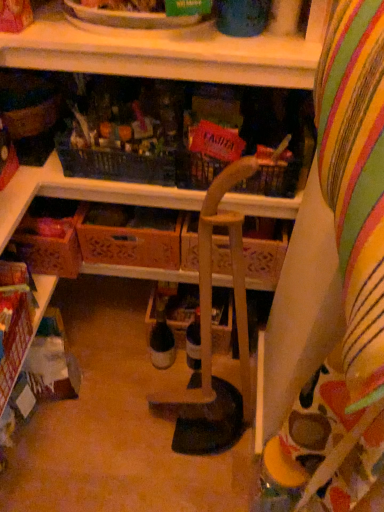
The height and width of the screenshot is (512, 384). Describe the element at coordinates (161, 338) in the screenshot. I see `translucent glass bottle at center` at that location.

What do you see at coordinates (24, 335) in the screenshot? Image resolution: width=384 pixels, height=512 pixels. I see `wooden crate at lower left, marked as the second shelf in a top-to-bottom arrangement` at bounding box center [24, 335].

Image resolution: width=384 pixels, height=512 pixels. What do you see at coordinates (211, 337) in the screenshot?
I see `wooden chair at center` at bounding box center [211, 337].

What is the approximate width of wooden crate at center, marked as the 2th drawer in a left-to-right arrangement?

wooden crate at center, marked as the 2th drawer in a left-to-right arrangement, is 11.72 inches in width.

What do you see at coordinates (130, 236) in the screenshot?
I see `wooden crate at center, positioned as the first drawer in right-to-left order` at bounding box center [130, 236].

Measure the distance between point (273,71) and camera.

Point (273,71) and camera are 87.20 centimeters apart from each other.

Locate an element on the screen. This screenshot has height=512, width=384. translucent glass bottle at center is located at coordinates (161, 338).

In the scene shown: Which object is positioned more to the left, wooden crate at lower left, the 1th shelf ordered from the bottom, or wooden crate at center, positioned as the first drawer in right-to-left order?

From the viewer's perspective, wooden crate at lower left, the 1th shelf ordered from the bottom, appears more on the left side.

From the image's perspective, is wooden crate at lower left, which ranks as the first shelf in left-to-right order, positioned above or below wooden crate at center, positioned as the first drawer in right-to-left order?

Based on their image positions, wooden crate at lower left, which ranks as the first shelf in left-to-right order, is located beneath wooden crate at center, positioned as the first drawer in right-to-left order.

Which of these two, wooden crate at lower left, which is counted as the second shelf, starting from the right, or wooden crate at center, marked as the 2th drawer in a left-to-right arrangement, is bigger?

With larger size is wooden crate at center, marked as the 2th drawer in a left-to-right arrangement.

Is wooden crate at lower left, which is counted as the second shelf, starting from the right, looking in the opposite direction of wooden crate at center, marked as the 2th drawer in a left-to-right arrangement?

wooden crate at lower left, which is counted as the second shelf, starting from the right, is not turned away from wooden crate at center, marked as the 2th drawer in a left-to-right arrangement.

What's the angular difference between wooden crate at center, marked as the 2th drawer in a left-to-right arrangement, and wooden at upper center, placed as the 1th shelf when sorted from top to bottom,'s facing directions?

1.4 degrees separate the facing orientations of wooden crate at center, marked as the 2th drawer in a left-to-right arrangement, and wooden at upper center, placed as the 1th shelf when sorted from top to bottom.

Considering the relative sizes of wooden crate at center, marked as the 2th drawer in a left-to-right arrangement, and wooden at upper center, the 2th shelf when ordered from bottom to top, in the image provided, is wooden crate at center, marked as the 2th drawer in a left-to-right arrangement, smaller than wooden at upper center, the 2th shelf when ordered from bottom to top,?

Indeed, wooden crate at center, marked as the 2th drawer in a left-to-right arrangement, has a smaller size compared to wooden at upper center, the 2th shelf when ordered from bottom to top.

Is wooden crate at center, positioned as the first drawer in right-to-left order, not within wooden at upper center, which is counted as the second shelf, starting from the left?

Absolutely, wooden crate at center, positioned as the first drawer in right-to-left order, is external to wooden at upper center, which is counted as the second shelf, starting from the left.

Does wooden crate at center, marked as the 2th drawer in a left-to-right arrangement, have a lesser width compared to wooden at upper center, placed as the 1th shelf when sorted from top to bottom?

Yes.

Which is in front, wooden chair at center or wooden at upper center, the first shelf viewed from the right?

Positioned in front is wooden chair at center.

I want to click on armchair below the wooden at upper center, placed as the 1th shelf when sorted from top to bottom (from the image's perspective), so click(x=211, y=337).

Would you say wooden at upper center, which is counted as the second shelf, starting from the left, is part of wooden chair at center's contents?

No.

From the image's perspective, is wooden chair at center located above or below wooden at upper center, the first shelf viewed from the right?

wooden chair at center is below wooden at upper center, the first shelf viewed from the right.

Is wooden chair at center not near wooden crate at center, positioned as the first drawer in right-to-left order?

Actually, wooden chair at center and wooden crate at center, positioned as the first drawer in right-to-left order, are a little close together.

Who is taller, wooden chair at center or wooden crate at center, marked as the 2th drawer in a left-to-right arrangement?

With more height is wooden chair at center.

Considering the relative positions of wooden chair at center and wooden crate at center, positioned as the first drawer in right-to-left order, in the image provided, is wooden chair at center to the left of wooden crate at center, positioned as the first drawer in right-to-left order, from the viewer's perspective?

No, wooden chair at center is not to the left of wooden crate at center, positioned as the first drawer in right-to-left order.

From a real-world perspective, is wooden chair at center above or below wooden crate at center, marked as the 2th drawer in a left-to-right arrangement?

wooden chair at center is situated higher than wooden crate at center, marked as the 2th drawer in a left-to-right arrangement, in the real world.

From a real-world perspective, who is located higher, wooden chair at center or translucent glass bottle at center?

wooden chair at center, from a real-world perspective.

Is point (248, 408) more distant than point (164, 329)?

No, it is not.

Is wooden chair at center oriented away from translucent glass bottle at center?

No, wooden chair at center's orientation is not away from translucent glass bottle at center.

Image resolution: width=384 pixels, height=512 pixels. Find the location of `armchair on the right side of translucent glass bottle at center`. armchair on the right side of translucent glass bottle at center is located at coordinates (211, 337).

Is wooden crate at center, marked as the 2th drawer in a left-to-right arrangement, bigger or smaller than wooden chair at center?

Considering their sizes, wooden crate at center, marked as the 2th drawer in a left-to-right arrangement, takes up less space than wooden chair at center.

Which is in front, wooden crate at center, positioned as the first drawer in right-to-left order, or wooden chair at center?

wooden chair at center.

Does wooden crate at center, marked as the 2th drawer in a left-to-right arrangement, have a greater width compared to wooden chair at center?

Yes, wooden crate at center, marked as the 2th drawer in a left-to-right arrangement, is wider than wooden chair at center.

Are wooden crate at center, positioned as the first drawer in right-to-left order, and wooden chair at center making contact?

No, wooden crate at center, positioned as the first drawer in right-to-left order, is not next to wooden chair at center.

From the wooden at upper center, the 2th shelf when ordered from bottom to top, count the 2nd drawer to the left and point to it. Please provide its 2D coordinates.

[(49, 238)]

Could you tell me if wooden at upper center, the 2th shelf when ordered from bottom to top, is facing wooden crate at lower left, acting as the first drawer starting from the left?

No, wooden at upper center, the 2th shelf when ordered from bottom to top, is not turned towards wooden crate at lower left, acting as the first drawer starting from the left.

Which is in front, wooden at upper center, the 2th shelf when ordered from bottom to top, or wooden crate at lower left, the 2th drawer when ordered from right to left?

wooden at upper center, the 2th shelf when ordered from bottom to top, is more forward.

Is wooden at upper center, the 2th shelf when ordered from bottom to top, at the right side of wooden crate at lower left, acting as the first drawer starting from the left?

Yes, wooden at upper center, the 2th shelf when ordered from bottom to top, is to the right of wooden crate at lower left, acting as the first drawer starting from the left.

Identify the location of the 1st shelf in front when counting from the wooden crate at center, positioned as the first drawer in right-to-left order. (24, 335).

Locate an element on the screen. the 2nd drawer behind the wooden at upper center, placed as the 1th shelf when sorted from top to bottom, counting from the anchor's position is located at coordinates (130, 236).

From the image, which object appears to be nearer to wooden chair at center, wooden crate at lower left, the 2th drawer when ordered from right to left, or translucent glass bottle at center?

translucent glass bottle at center is positioned closer to the anchor wooden chair at center.

When comparing their distances from wooden crate at lower left, the 2th drawer when ordered from right to left, does wooden chair at center or wooden crate at lower left, the 1th shelf ordered from the bottom, seem closer?

Among the two, wooden crate at lower left, the 1th shelf ordered from the bottom, is located nearer to wooden crate at lower left, the 2th drawer when ordered from right to left.

Which object lies further to the anchor point wooden crate at lower left, the 2th drawer when ordered from right to left, wooden at upper center, which is counted as the second shelf, starting from the left, or translucent glass bottle at center?

Among the two, wooden at upper center, which is counted as the second shelf, starting from the left, is located further to wooden crate at lower left, the 2th drawer when ordered from right to left.

Estimate the real-world distances between objects in this image. Which object is closer to wooden chair at center, translucent glass bottle at center or wooden crate at lower left, marked as the second shelf in a top-to-bottom arrangement?

translucent glass bottle at center is closer to wooden chair at center.

Which object lies further to the anchor point wooden crate at lower left, marked as the second shelf in a top-to-bottom arrangement, wooden at upper center, the first shelf viewed from the right, or wooden crate at lower left, the 2th drawer when ordered from right to left?

wooden at upper center, the first shelf viewed from the right.

In the scene shown: Based on their spatial positions, is wooden at upper center, the 2th shelf when ordered from bottom to top, or wooden crate at center, positioned as the first drawer in right-to-left order, further from wooden chair at center?

Based on the image, wooden at upper center, the 2th shelf when ordered from bottom to top, appears to be further to wooden chair at center.

Which object lies nearer to the anchor point wooden chair at center, translucent glass bottle at center or wooden crate at lower left, the 2th drawer when ordered from right to left?

translucent glass bottle at center is positioned closer to the anchor wooden chair at center.

Looking at the image, which one is located closer to wooden crate at lower left, the 1th shelf ordered from the bottom, wooden at upper center, the first shelf viewed from the right, or wooden chair at center?

wooden chair at center.

Find the location of a particular element. armchair between wooden at upper center, the 2th shelf when ordered from bottom to top, and wooden crate at lower left, which is counted as the second shelf, starting from the right, in the up-down direction is located at coordinates (211, 337).

Locate an element on the screen. This screenshot has height=512, width=384. drawer between wooden at upper center, the 2th shelf when ordered from bottom to top, and wooden crate at lower left, the 2th drawer when ordered from right to left, vertically is located at coordinates (130, 236).

Locate an element on the screen. The image size is (384, 512). drawer positioned between wooden chair at center and wooden crate at center, marked as the 2th drawer in a left-to-right arrangement, from near to far is located at coordinates (49, 238).

Where is `armchair that lies between wooden at upper center, the first shelf viewed from the right, and translucent glass bottle at center from top to bottom`? The image size is (384, 512). armchair that lies between wooden at upper center, the first shelf viewed from the right, and translucent glass bottle at center from top to bottom is located at coordinates [211, 337].